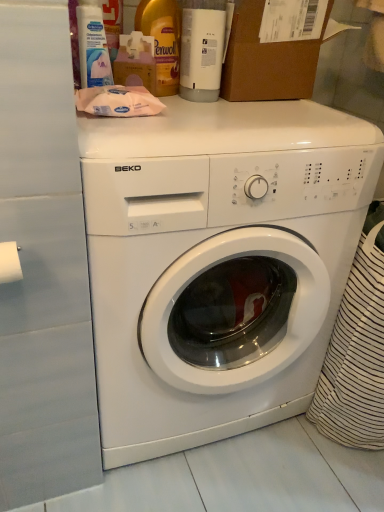
This screenshot has height=512, width=384. Find the location of `free space in front of brown cardboard box at upper center`. free space in front of brown cardboard box at upper center is located at coordinates (269, 116).